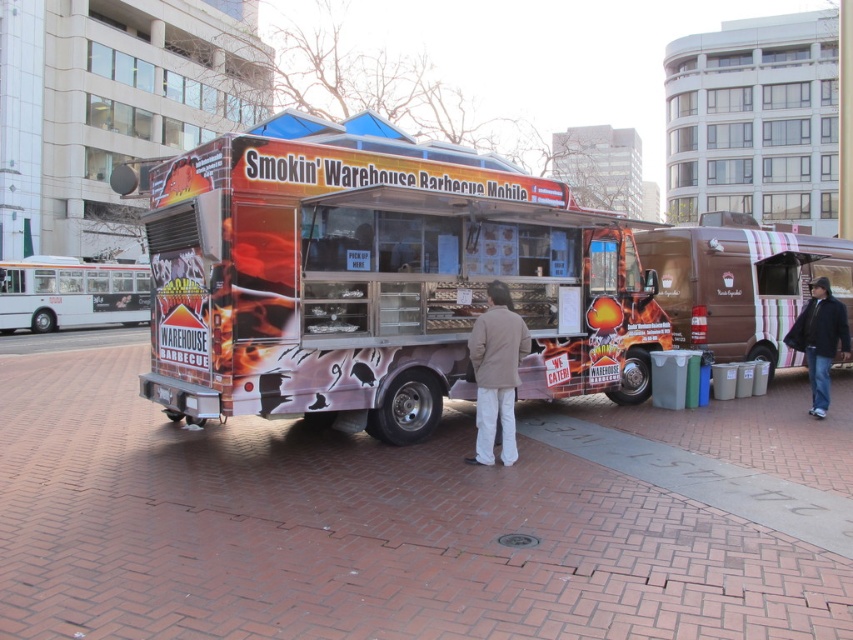
Question: Is light beige jacket at center wider than dark blue jeans at lower right?

Choices:
 (A) no
 (B) yes

Answer: (B)

Question: Does brick pavement at center have a lesser width compared to light beige jacket at center?

Choices:
 (A) no
 (B) yes

Answer: (A)

Question: Which is farther from the light beige jacket at center?

Choices:
 (A) dark blue jeans at lower right
 (B) matte orange food truck at center

Answer: (A)

Question: Which object is farther from the camera taking this photo?

Choices:
 (A) light beige jacket at center
 (B) matte orange food truck at center
 (C) brick pavement at center
 (D) dark blue jeans at lower right

Answer: (D)

Question: Does brick pavement at center appear on the left side of dark blue jeans at lower right?

Choices:
 (A) yes
 (B) no

Answer: (A)

Question: Which point is closer to the camera?

Choices:
 (A) (808, 369)
 (B) (492, 337)

Answer: (B)